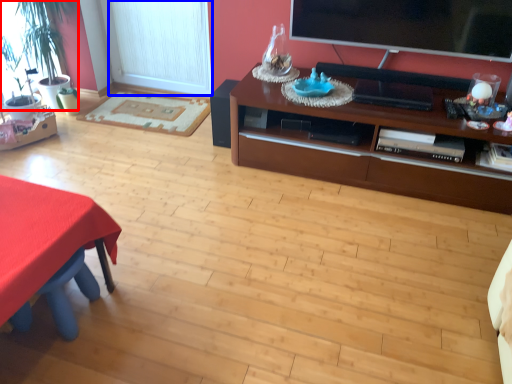
Question: Among these objects, which one is farthest to the camera, houseplant (highlighted by a red box) or window screen (highlighted by a blue box)?

Choices:
 (A) houseplant
 (B) window screen

Answer: (B)